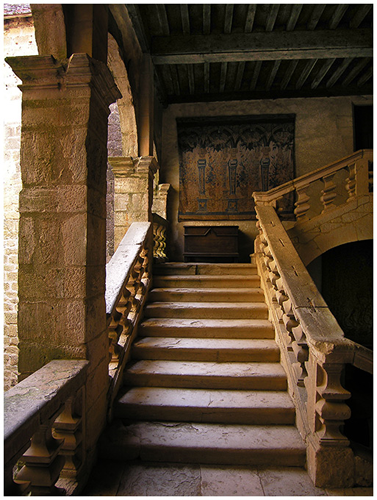
At what (x,y) coordinates should I click in order to perform the action: click on stair. Please return your answer as a coordinate pair (x, y). Image resolution: width=377 pixels, height=500 pixels. Looking at the image, I should click on (212, 445), (210, 402), (210, 379), (214, 351), (210, 329), (219, 311), (213, 296), (211, 284), (206, 270).